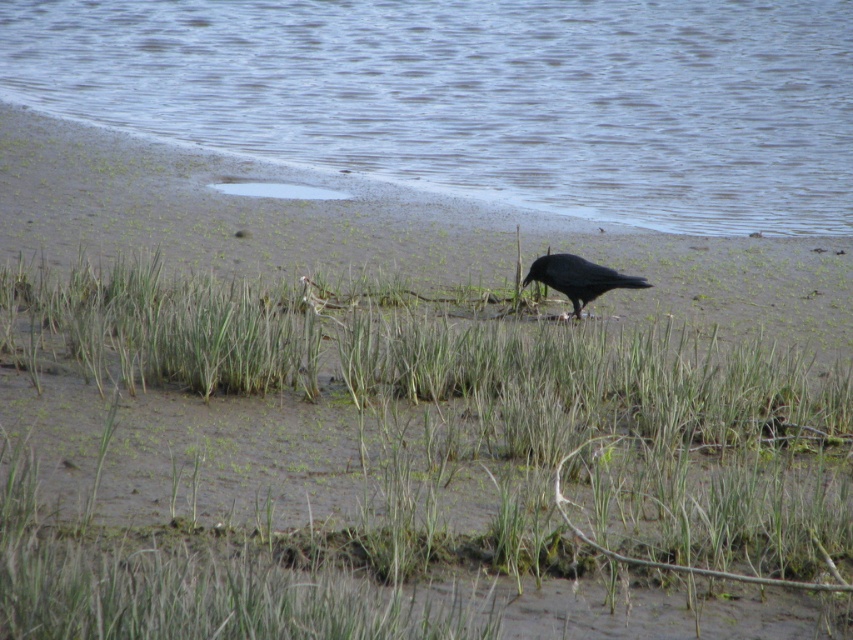
You are standing in a wetland area and see a small bird on the mud. There is a point marked at coordinates (480, 97). What is located at that point?

The point at (480, 97) indicates clear water at lower left.

You are standing in the wetland area and see two points marked in the image. Which point is closer to you, point (790, 17) or point (625, 285)?

Point (790, 17) is closer to you because it is further to the viewer than point (625, 285).